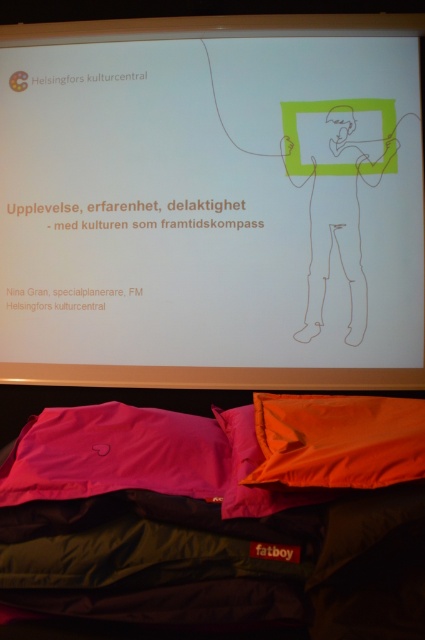
You are an attendee at a presentation and notice two points marked on the projected slide. The first point is labeled as point 1 at coordinates (65, 460) and the second point is labeled as point 2 at coordinates (229, 508). From your perspective sitting in the front row, which point appears closer to you?

Point 1 at coordinates (65, 460) is behind point 2 at coordinates (229, 508), so point 2 appears closer to you.

You are an interior designer planning to hang a 32 inch painting between the white paper at upper center and the orange fabric pillow at lower center. Can the painting fit in the space between them?

The white paper at upper center is 33.90 inches from the orange fabric pillow at lower center. Since the painting is 32 inches wide, it can fit in the space between them as the distance is slightly larger than the painting.